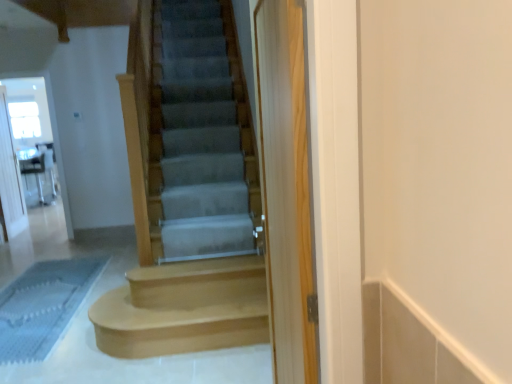
Where is `clear glass screen door at left, acting as the first screen door starting from the left`? The width and height of the screenshot is (512, 384). clear glass screen door at left, acting as the first screen door starting from the left is located at coordinates (10, 178).

Identify the location of blue textured bath mat at lower left. (42, 305).

How much space does smooth gray carpet at center, which appears as the 2th stairs when viewed from the back, occupy vertically?

94.67 centimeters.

What are the coordinates of `light brown wood stairs at center, which is the second stairs from front to back` in the screenshot? It's located at (184, 309).

This screenshot has width=512, height=384. Describe the element at coordinates (286, 187) in the screenshot. I see `clear wood screen door at center, arranged as the third screen door when viewed from the back` at that location.

Identify the location of clear glass screen door at upper left, the second screen door viewed from the front. Image resolution: width=512 pixels, height=384 pixels. (58, 154).

Is clear wood screen door at center, which is the 3th screen door from left to right, inside or outside of light brown wood stairs at center, the first stairs when ordered from bottom to top?

The correct answer is: outside.

Considering the points (305, 255) and (220, 337), which point is in front, point (305, 255) or point (220, 337)?

The point (305, 255) is closer.

Is clear wood screen door at center, which is the 3th screen door from left to right, oriented away from light brown wood stairs at center, the first stairs when ordered from bottom to top?

clear wood screen door at center, which is the 3th screen door from left to right, does not have its back to light brown wood stairs at center, the first stairs when ordered from bottom to top.

Are clear wood screen door at center, arranged as the third screen door when viewed from the back, and light brown wood stairs at center, the first stairs when ordered from bottom to top, located far from each other?

→ That's right, there is a large distance between clear wood screen door at center, arranged as the third screen door when viewed from the back, and light brown wood stairs at center, the first stairs when ordered from bottom to top.

The width and height of the screenshot is (512, 384). I want to click on screen door that is the 3rd object directly below the smooth gray carpet at center, which appears as the 1th stairs when viewed from the top (from a real-world perspective), so click(10, 178).

Is clear glass screen door at left, the 1th screen door from the back, oriented towards smooth gray carpet at center, arranged as the 1th stairs when viewed from the front?

No, clear glass screen door at left, the 1th screen door from the back, is not turned towards smooth gray carpet at center, arranged as the 1th stairs when viewed from the front.

From a real-world perspective, does clear glass screen door at left, acting as the first screen door starting from the left, stand above smooth gray carpet at center, positioned as the second stairs in bottom-to-top order?

Incorrect, from a real-world perspective, clear glass screen door at left, acting as the first screen door starting from the left, is lower than smooth gray carpet at center, positioned as the second stairs in bottom-to-top order.

Is blue textured bath mat at lower left not inside clear glass screen door at left, acting as the 3th screen door starting from the front?

That's correct, blue textured bath mat at lower left is outside of clear glass screen door at left, acting as the 3th screen door starting from the front.

Does blue textured bath mat at lower left have a greater width compared to clear glass screen door at left, acting as the 3th screen door starting from the front?

Yes, blue textured bath mat at lower left is wider than clear glass screen door at left, acting as the 3th screen door starting from the front.

Is blue textured bath mat at lower left taller or shorter than clear glass screen door at left, the third screen door from the right?

Considering their sizes, blue textured bath mat at lower left has less height than clear glass screen door at left, the third screen door from the right.

Where is `bath mat on the right of the clear glass screen door at left, the 1th screen door from the back`? The width and height of the screenshot is (512, 384). bath mat on the right of the clear glass screen door at left, the 1th screen door from the back is located at coordinates (42, 305).

Could you tell me if smooth gray carpet at center, which appears as the 1th stairs when viewed from the top, is facing clear glass screen door at left, the 1th screen door from the back?

No, smooth gray carpet at center, which appears as the 1th stairs when viewed from the top, does not turn towards clear glass screen door at left, the 1th screen door from the back.

From a real-world perspective, is smooth gray carpet at center, which appears as the 2th stairs when viewed from the back, physically located above or below clear glass screen door at left, the 1th screen door from the back?

smooth gray carpet at center, which appears as the 2th stairs when viewed from the back, is above clear glass screen door at left, the 1th screen door from the back.

Which of these two, smooth gray carpet at center, which appears as the 2th stairs when viewed from the back, or clear glass screen door at left, acting as the first screen door starting from the left, is wider?

With larger width is smooth gray carpet at center, which appears as the 2th stairs when viewed from the back.

Considering the positions of objects smooth gray carpet at center, which appears as the 2th stairs when viewed from the back, and clear glass screen door at left, the 1th screen door from the back, in the image provided, who is more to the right, smooth gray carpet at center, which appears as the 2th stairs when viewed from the back, or clear glass screen door at left, the 1th screen door from the back,?

smooth gray carpet at center, which appears as the 2th stairs when viewed from the back, is more to the right.

Which object is closer to the camera taking this photo, clear glass screen door at left, acting as the 3th screen door starting from the front, or blue textured bath mat at lower left?

blue textured bath mat at lower left.

Which is further, (20, 206) or (24, 327)?

Positioned behind is point (20, 206).

Does clear glass screen door at left, the 1th screen door from the back, have a larger size compared to blue textured bath mat at lower left?

Correct, clear glass screen door at left, the 1th screen door from the back, is larger in size than blue textured bath mat at lower left.

Considering the relative sizes of clear glass screen door at left, acting as the 3th screen door starting from the front, and blue textured bath mat at lower left in the image provided, is clear glass screen door at left, acting as the 3th screen door starting from the front, shorter than blue textured bath mat at lower left?

No.

Does smooth gray carpet at center, which appears as the 1th stairs when viewed from the top, contain blue textured bath mat at lower left?

No, blue textured bath mat at lower left is not a part of smooth gray carpet at center, which appears as the 1th stairs when viewed from the top.

Is smooth gray carpet at center, which appears as the 1th stairs when viewed from the top, with blue textured bath mat at lower left?

smooth gray carpet at center, which appears as the 1th stairs when viewed from the top, is not next to blue textured bath mat at lower left, and they're not touching.

Does point (182, 349) come farther from viewer compared to point (15, 313)?

No, it is not.

Is smooth gray carpet at center, which appears as the 2th stairs when viewed from the back, positioned with its back to blue textured bath mat at lower left?

No, smooth gray carpet at center, which appears as the 2th stairs when viewed from the back,'s orientation is not away from blue textured bath mat at lower left.

From the image's perspective, is smooth gray carpet at center, which appears as the 1th stairs when viewed from the top, located above or below light brown wood stairs at center, which is counted as the second stairs, starting from the top?

smooth gray carpet at center, which appears as the 1th stairs when viewed from the top, is situated higher than light brown wood stairs at center, which is counted as the second stairs, starting from the top, in the image.

Can you confirm if smooth gray carpet at center, positioned as the second stairs in bottom-to-top order, is bigger than light brown wood stairs at center, the first stairs when ordered from bottom to top?

Actually, smooth gray carpet at center, positioned as the second stairs in bottom-to-top order, might be smaller than light brown wood stairs at center, the first stairs when ordered from bottom to top.

Would you say smooth gray carpet at center, which appears as the 2th stairs when viewed from the back, is inside or outside light brown wood stairs at center, which appears as the first stairs when viewed from the back?

smooth gray carpet at center, which appears as the 2th stairs when viewed from the back, exists outside the volume of light brown wood stairs at center, which appears as the first stairs when viewed from the back.

Is point (233, 158) in front of point (94, 309)?

No, it is not.

From a real-world perspective, count 2nd screen doors upward from the light brown wood stairs at center, which is the second stairs from front to back, and point to it. Please provide its 2D coordinates.

[(286, 187)]

Locate an element on the screen. stairs that is the 2nd object to the right of the clear glass screen door at left, acting as the 3th screen door starting from the front, starting at the anchor is located at coordinates (189, 196).

Looking at the image, which one is located closer to clear glass screen door at left, acting as the first screen door starting from the left, clear wood screen door at center, which is the 3th screen door from left to right, or light brown wood stairs at center, which is counted as the second stairs, starting from the top?

light brown wood stairs at center, which is counted as the second stairs, starting from the top, is positioned closer to the anchor clear glass screen door at left, acting as the first screen door starting from the left.

Looking at the image, which one is located closer to smooth gray carpet at center, which appears as the 1th stairs when viewed from the top, clear glass screen door at left, the 1th screen door from the back, or blue textured bath mat at lower left?

The object closer to smooth gray carpet at center, which appears as the 1th stairs when viewed from the top, is blue textured bath mat at lower left.

Considering their positions, is clear glass screen door at upper left, the 2th screen door from the left, positioned further to smooth gray carpet at center, which appears as the 1th stairs when viewed from the top, than clear wood screen door at center, positioned as the 1th screen door in front-to-back order?

Based on the image, clear glass screen door at upper left, the 2th screen door from the left, appears to be further to smooth gray carpet at center, which appears as the 1th stairs when viewed from the top.

Based on the photo, from the image, which object appears to be farther from clear glass screen door at left, the 1th screen door from the back, blue textured bath mat at lower left or clear glass screen door at upper left, the second screen door when ordered from back to front?

Based on the image, blue textured bath mat at lower left appears to be further to clear glass screen door at left, the 1th screen door from the back.

When comparing their distances from clear wood screen door at center, arranged as the third screen door when viewed from the back, does blue textured bath mat at lower left or light brown wood stairs at center, which appears as the first stairs when viewed from the back, seem further?

Among the two, blue textured bath mat at lower left is located further to clear wood screen door at center, arranged as the third screen door when viewed from the back.

Based on their spatial positions, is clear glass screen door at left, acting as the 3th screen door starting from the front, or clear wood screen door at center, which is the first screen door from right to left, further from clear glass screen door at upper left, the second screen door when ordered from back to front?

clear wood screen door at center, which is the first screen door from right to left, is positioned further to the anchor clear glass screen door at upper left, the second screen door when ordered from back to front.

Looking at the image, which one is located further to clear wood screen door at center, which is the 3th screen door from left to right, smooth gray carpet at center, positioned as the second stairs in bottom-to-top order, or clear glass screen door at left, acting as the 3th screen door starting from the front?

Based on the image, clear glass screen door at left, acting as the 3th screen door starting from the front, appears to be further to clear wood screen door at center, which is the 3th screen door from left to right.

From the image, which object appears to be farther from clear glass screen door at left, the 1th screen door from the back, clear glass screen door at upper left, acting as the second screen door starting from the right, or light brown wood stairs at center, which is the second stairs from front to back?

light brown wood stairs at center, which is the second stairs from front to back, is further to clear glass screen door at left, the 1th screen door from the back.

Locate an element on the screen. This screenshot has height=384, width=512. stairs between smooth gray carpet at center, which appears as the 2th stairs when viewed from the back, and clear glass screen door at upper left, the second screen door when ordered from back to front, from front to back is located at coordinates (184, 309).

The width and height of the screenshot is (512, 384). I want to click on bath mat between clear wood screen door at center, positioned as the 1th screen door in front-to-back order, and clear glass screen door at upper left, the 2th screen door from the left, in the front-back direction, so click(42, 305).

Image resolution: width=512 pixels, height=384 pixels. What are the coordinates of `stairs between clear wood screen door at center, arranged as the third screen door when viewed from the back, and clear glass screen door at left, the 1th screen door from the back, along the z-axis` in the screenshot? It's located at (184, 309).

Locate an element on the screen. The width and height of the screenshot is (512, 384). bath mat positioned between smooth gray carpet at center, which appears as the 1th stairs when viewed from the top, and clear glass screen door at upper left, acting as the second screen door starting from the right, from near to far is located at coordinates [42, 305].